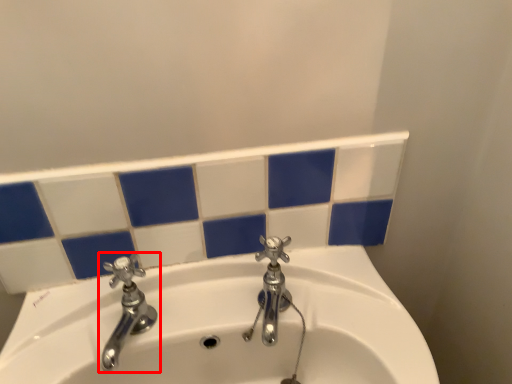
Question: Where is tap (annotated by the red box) located in relation to tap in the image?

Choices:
 (A) right
 (B) left

Answer: (B)